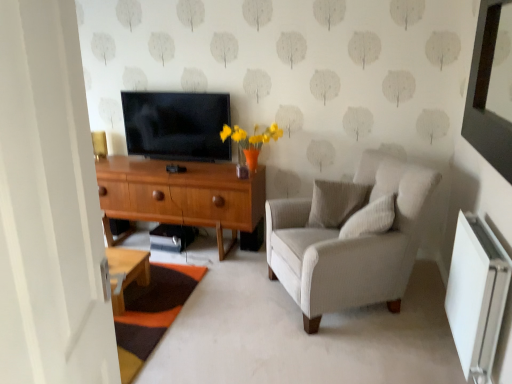
This screenshot has width=512, height=384. What do you see at coordinates (370, 218) in the screenshot?
I see `white textured pillow at upper right, the 2th pillow from the back` at bounding box center [370, 218].

Locate an element on the screen. light gray fabric armchair at right is located at coordinates (350, 239).

In order to face matte black tv at center, should I rotate leftwards or rightwards?

It's best to rotate left around 10.685 degrees.

Measure the distance between wooden desk at center and camera.

They are 3.06 meters apart.

Describe the element at coordinates (181, 195) in the screenshot. This screenshot has height=384, width=512. I see `wooden desk at center` at that location.

Where is `white textured pillow at upper right, the 2th pillow from the back`? The image size is (512, 384). white textured pillow at upper right, the 2th pillow from the back is located at coordinates (370, 218).

Could wooden desk at center be considered to be inside white textured pillow at upper right, the 2th pillow from the back?

Definitely not — wooden desk at center is not inside white textured pillow at upper right, the 2th pillow from the back.

Considering the relative sizes of white textured pillow at upper right, marked as the first pillow in a front-to-back arrangement, and wooden desk at center in the image provided, is white textured pillow at upper right, marked as the first pillow in a front-to-back arrangement, smaller than wooden desk at center?

Correct, white textured pillow at upper right, marked as the first pillow in a front-to-back arrangement, occupies less space than wooden desk at center.

Can you confirm if white textured pillow at upper right, the 2th pillow from the back, is taller than wooden desk at center?

Incorrect, the height of white textured pillow at upper right, the 2th pillow from the back, is not larger of that of wooden desk at center.

Can you confirm if white textured pillow at upper right, the 2th pillow from the back, is positioned to the left of wooden desk at center?

No, white textured pillow at upper right, the 2th pillow from the back, is not to the left of wooden desk at center.

From the image's perspective, between white plastic radiator at lower right and wooden desk at center, which one is located above?

wooden desk at center.

Is white plastic radiator at lower right shorter than wooden desk at center?

Yes.

Is white plastic radiator at lower right outside of wooden desk at center?

white plastic radiator at lower right is positioned outside wooden desk at center.

In terms of size, does white textured pillow at upper right, the 2th pillow from the back, appear bigger or smaller than matte black tv at center?

Considering their sizes, white textured pillow at upper right, the 2th pillow from the back, takes up less space than matte black tv at center.

Which object is wider, white textured pillow at upper right, the 2th pillow from the back, or matte black tv at center?

Wider between the two is white textured pillow at upper right, the 2th pillow from the back.

The height and width of the screenshot is (384, 512). What are the coordinates of `the 2nd pillow positioned below the matte black tv at center (from the image's perspective)` in the screenshot? It's located at (370, 218).

Is matte black tv at center completely or partially inside white textured pillow at upper right, the 2th pillow from the back?

That's incorrect, matte black tv at center is not inside white textured pillow at upper right, the 2th pillow from the back.

From the image's perspective, is white textured pillow at upper right, marked as the first pillow in a front-to-back arrangement, below light gray fabric armchair at right?

No.

Considering the relative sizes of white textured pillow at upper right, marked as the first pillow in a front-to-back arrangement, and light gray fabric armchair at right in the image provided, is white textured pillow at upper right, marked as the first pillow in a front-to-back arrangement, taller than light gray fabric armchair at right?

Incorrect, the height of white textured pillow at upper right, marked as the first pillow in a front-to-back arrangement, is not larger of that of light gray fabric armchair at right.

Is white textured pillow at upper right, the 2th pillow from the back, turned away from light gray fabric armchair at right?

That's right, white textured pillow at upper right, the 2th pillow from the back, is facing away from light gray fabric armchair at right.

What's the angular difference between wooden desk at center and light gray fabric armchair at right's facing directions?

Answer: wooden desk at center and light gray fabric armchair at right are facing 58.8 degrees away from each other.

Is wooden desk at center not close to light gray fabric armchair at right?

No, wooden desk at center is not far away from light gray fabric armchair at right.

You are a GUI agent. You are given a task and a screenshot of the screen. Output one action in this format:
    pyautogui.click(x=<x>, y=<y>)
    Task: Click on the chair below the wooden desk at center (from the image's perspective)
    The width and height of the screenshot is (512, 384).
    Given the screenshot: What is the action you would take?
    pyautogui.click(x=350, y=239)

Based on their positions, is wooden desk at center located to the left or right of light gray fabric armchair at right?

Based on their positions, wooden desk at center is located to the left of light gray fabric armchair at right.

Which of these two, wooden desk at center or white plastic radiator at lower right, is smaller?

Smaller between the two is white plastic radiator at lower right.

Can you confirm if wooden desk at center is positioned to the right of white plastic radiator at lower right?

Incorrect, wooden desk at center is not on the right side of white plastic radiator at lower right.

Can you tell me how much wooden desk at center and white plastic radiator at lower right differ in facing direction?

The angle between the facing direction of wooden desk at center and the facing direction of white plastic radiator at lower right is 89.7 degrees.

Considering the relative sizes of wooden desk at center and white plastic radiator at lower right in the image provided, is wooden desk at center thinner than white plastic radiator at lower right?

In fact, wooden desk at center might be wider than white plastic radiator at lower right.

From a real-world perspective, is white textured pillow at center, marked as the 2th pillow in a front-to-back arrangement, physically located above or below light gray fabric armchair at right?

In terms of real-world spatial position, white textured pillow at center, marked as the 2th pillow in a front-to-back arrangement, is above light gray fabric armchair at right.

Looking at this image, considering the positions of objects white textured pillow at center, which is counted as the 1th pillow, starting from the back, and light gray fabric armchair at right in the image provided, who is more to the left, white textured pillow at center, which is counted as the 1th pillow, starting from the back, or light gray fabric armchair at right?

Positioned to the left is white textured pillow at center, which is counted as the 1th pillow, starting from the back.

Which is behind, white textured pillow at center, which is counted as the 1th pillow, starting from the back, or light gray fabric armchair at right?

white textured pillow at center, which is counted as the 1th pillow, starting from the back, is more distant.

In the image, there is a white textured pillow at center, marked as the 2th pillow in a front-to-back arrangement. Where is `chair below it (from the image's perspective)`? chair below it (from the image's perspective) is located at coordinates (350, 239).

Identify the location of the 2nd pillow positioned above the wooden desk at center (from a real-world perspective). (370, 218).

This screenshot has height=384, width=512. In order to click on desk below the white plastic radiator at lower right (from a real-world perspective) in this screenshot , I will do `click(181, 195)`.

Based on their spatial positions, is white plastic radiator at lower right or light gray fabric armchair at right further from white textured pillow at center, marked as the 2th pillow in a front-to-back arrangement?

white plastic radiator at lower right is positioned further to the anchor white textured pillow at center, marked as the 2th pillow in a front-to-back arrangement.

Estimate the real-world distances between objects in this image. Which object is closer to light gray fabric armchair at right, matte black tv at center or white textured pillow at upper right, marked as the first pillow in a front-to-back arrangement?

white textured pillow at upper right, marked as the first pillow in a front-to-back arrangement, is closer to light gray fabric armchair at right.

Estimate the real-world distances between objects in this image. Which object is further from matte black tv at center, white plastic radiator at lower right or white textured pillow at upper right, the 2th pillow from the back?

The object further to matte black tv at center is white plastic radiator at lower right.

Looking at the image, which one is located further to white textured pillow at upper right, the 2th pillow from the back, matte black tv at center or white textured pillow at center, which is counted as the 1th pillow, starting from the back?

matte black tv at center lies further to white textured pillow at upper right, the 2th pillow from the back, than the other object.

In the scene shown: Considering their positions, is white textured pillow at upper right, the 2th pillow from the back, positioned further to wooden desk at center than white plastic radiator at lower right?

The object further to wooden desk at center is white plastic radiator at lower right.

Based on their spatial positions, is white textured pillow at center, which is counted as the 1th pillow, starting from the back, or white textured pillow at upper right, the 2th pillow from the back, closer to light gray fabric armchair at right?

Based on the image, white textured pillow at upper right, the 2th pillow from the back, appears to be nearer to light gray fabric armchair at right.

Looking at this image, estimate the real-world distances between objects in this image. Which object is further from wooden desk at center, white plastic radiator at lower right or white textured pillow at upper right, marked as the first pillow in a front-to-back arrangement?

The object further to wooden desk at center is white plastic radiator at lower right.

Estimate the real-world distances between objects in this image. Which object is closer to matte black tv at center, light gray fabric armchair at right or white textured pillow at upper right, marked as the first pillow in a front-to-back arrangement?

light gray fabric armchair at right lies closer to matte black tv at center than the other object.

At what (x,y) coordinates should I click in order to perform the action: click on television between wooden desk at center and white plastic radiator at lower right from left to right. Please return your answer as a coordinate pair (x, y). The height and width of the screenshot is (384, 512). Looking at the image, I should click on (177, 125).

I want to click on chair between wooden desk at center and white textured pillow at upper right, the 2th pillow from the back, from left to right, so click(350, 239).

The height and width of the screenshot is (384, 512). Identify the location of pillow between matte black tv at center and white textured pillow at upper right, the 2th pillow from the back, in the horizontal direction. (336, 203).

Find the location of a particular element. The width and height of the screenshot is (512, 384). television located between wooden desk at center and white textured pillow at center, which is counted as the 1th pillow, starting from the back, in the left-right direction is located at coordinates (177, 125).